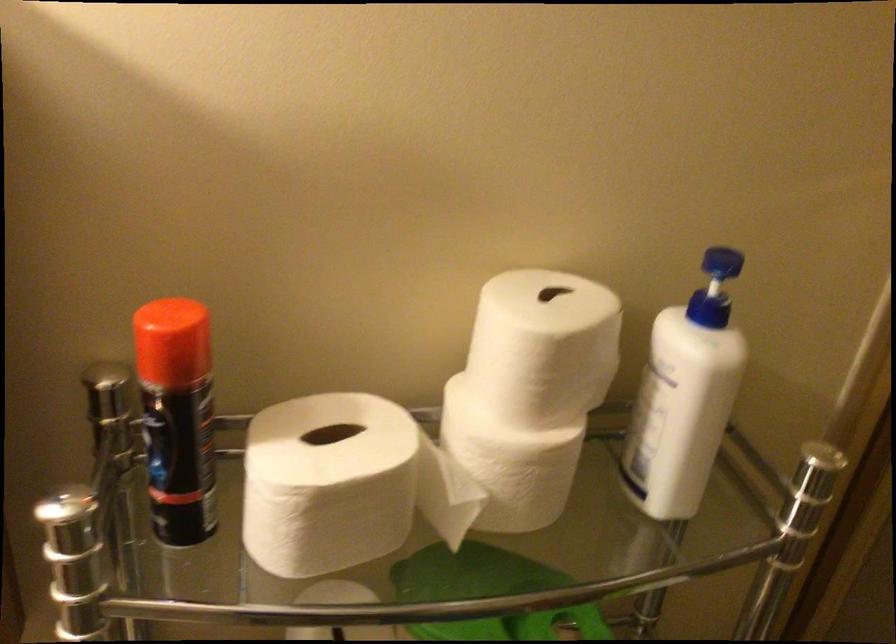
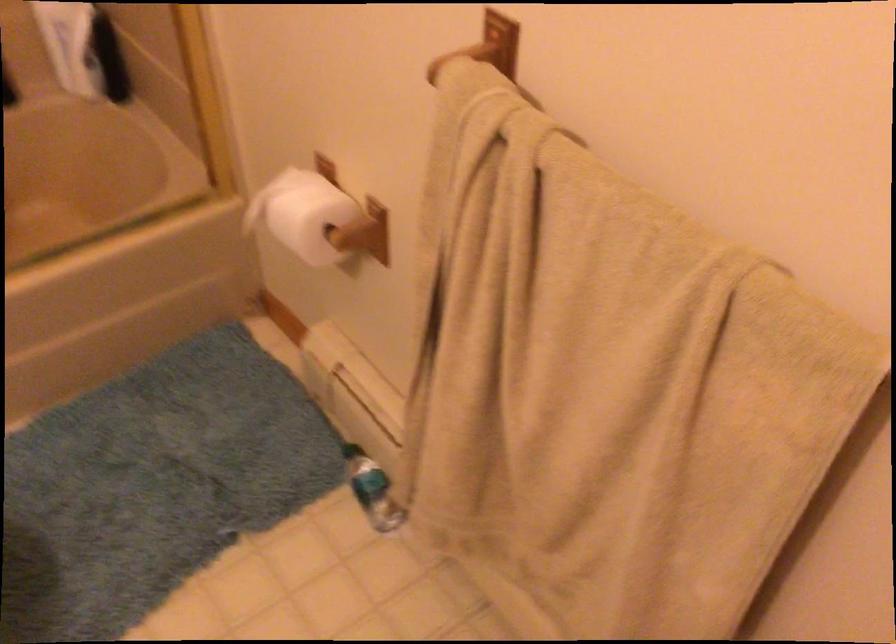
How did the camera likely rotate?

The camera's rotation is toward right-down.